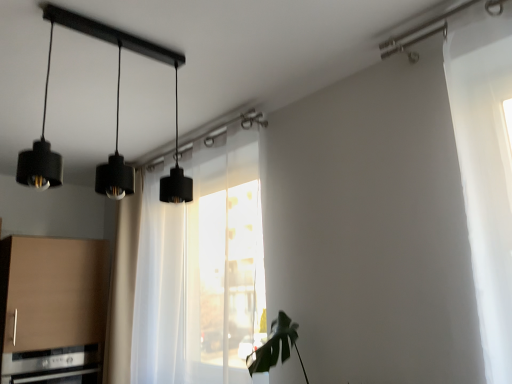
Question: Does matte black pendant light at upper left have a smaller size compared to satin silver oven at lower left?

Choices:
 (A) no
 (B) yes

Answer: (B)

Question: Considering the relative sizes of matte black pendant light at upper left and satin silver oven at lower left in the image provided, is matte black pendant light at upper left shorter than satin silver oven at lower left?

Choices:
 (A) yes
 (B) no

Answer: (B)

Question: Is matte black pendant light at upper left closer to camera compared to satin silver oven at lower left?

Choices:
 (A) no
 (B) yes

Answer: (B)

Question: Are matte black pendant light at upper left and satin silver oven at lower left far apart?

Choices:
 (A) yes
 (B) no

Answer: (A)

Question: Is matte black pendant light at upper left at the right side of satin silver oven at lower left?

Choices:
 (A) yes
 (B) no

Answer: (A)

Question: Is matte black pendant light at upper left taller or shorter than transparent fabric at center?

Choices:
 (A) short
 (B) tall

Answer: (A)

Question: Choose the correct answer: Is matte black pendant light at upper left inside transparent fabric at center or outside it?

Choices:
 (A) inside
 (B) outside

Answer: (B)

Question: Looking at their shapes, would you say matte black pendant light at upper left is wider or thinner than transparent fabric at center?

Choices:
 (A) thin
 (B) wide

Answer: (B)

Question: From the image's perspective, relative to transparent fabric at center, is matte black pendant light at upper left above or below?

Choices:
 (A) below
 (B) above

Answer: (B)

Question: Is satin silver oven at lower left taller or shorter than transparent fabric at center?

Choices:
 (A) tall
 (B) short

Answer: (B)

Question: From a real-world perspective, is satin silver oven at lower left physically located above or below transparent fabric at center?

Choices:
 (A) above
 (B) below

Answer: (B)

Question: Considering the positions of point (14, 377) and point (251, 137), is point (14, 377) closer or farther from the camera than point (251, 137)?

Choices:
 (A) farther
 (B) closer

Answer: (A)

Question: From the image's perspective, is satin silver oven at lower left above or below transparent fabric at center?

Choices:
 (A) above
 (B) below

Answer: (B)

Question: Is satin silver oven at lower left in front of or behind matte black pendant light at upper left in the image?

Choices:
 (A) behind
 (B) front

Answer: (A)

Question: From the image's perspective, relative to matte black pendant light at upper left, is satin silver oven at lower left above or below?

Choices:
 (A) below
 (B) above

Answer: (A)